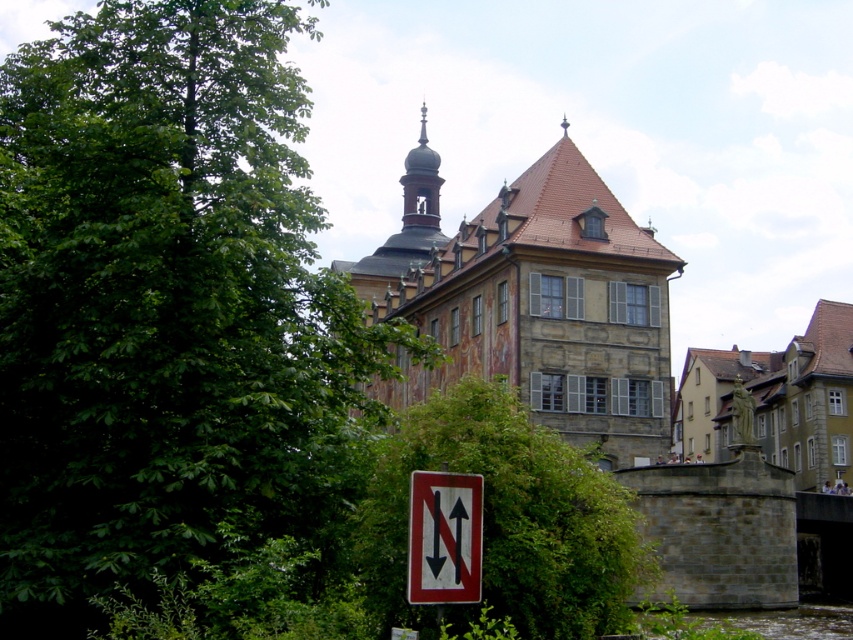
Question: Which point is closer to the camera?

Choices:
 (A) stone building at center
 (B) stone statue at right

Answer: (A)

Question: Which object appears farthest from the camera in this image?

Choices:
 (A) stone building at center
 (B) white plastic sign at lower center

Answer: (A)

Question: Is green leafy tree at center bigger than stone statue at right?

Choices:
 (A) yes
 (B) no

Answer: (B)

Question: Can you confirm if green leafy tree at left is bigger than stone statue at right?

Choices:
 (A) yes
 (B) no

Answer: (A)

Question: Which object is the farthest from the stone statue at right?

Choices:
 (A) green leafy tree at left
 (B) white plastic sign at lower center
 (C) stone building at center

Answer: (B)

Question: Does stone building at center appear on the left side of green leafy tree at center?

Choices:
 (A) yes
 (B) no

Answer: (B)